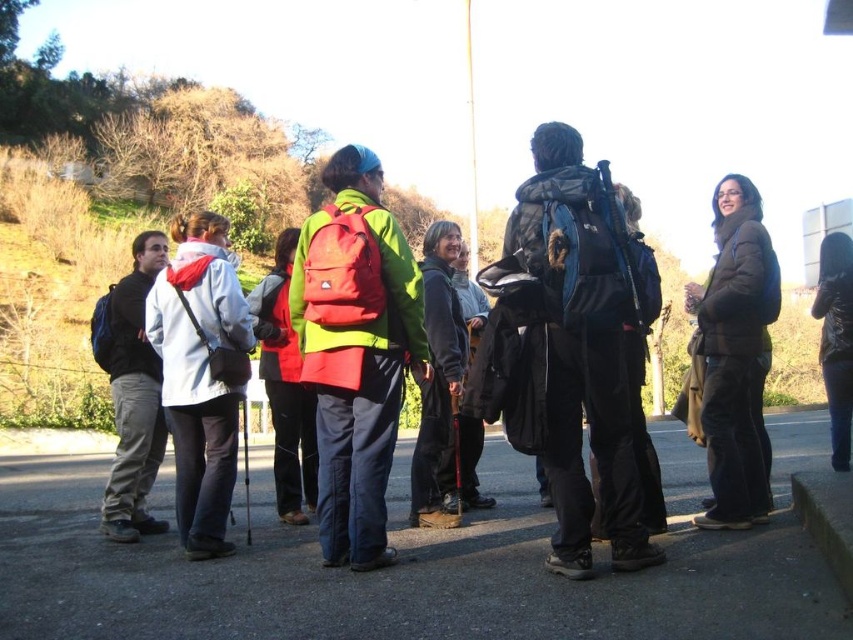
Question: Is dark blue backpack at center to the left of red matte backpack at center from the viewer's perspective?

Choices:
 (A) no
 (B) yes

Answer: (A)

Question: Can you confirm if dark blue backpack at center is positioned to the right of brown matte jacket at center?

Choices:
 (A) no
 (B) yes

Answer: (A)

Question: Which is farther from the brown matte jacket at center?

Choices:
 (A) matte black backpack at left
 (B) red matte backpack at center

Answer: (A)

Question: Does dark blue backpack at center appear on the left side of black textured jacket at right?

Choices:
 (A) no
 (B) yes

Answer: (B)

Question: Which object is closer to the camera taking this photo?

Choices:
 (A) black textured jacket at right
 (B) matte green safety vest at center
 (C) matte black backpack at center

Answer: (B)

Question: Among these objects, which one is farthest from the camera?

Choices:
 (A) white matte jacket at left
 (B) matte green safety vest at center
 (C) dark blue backpack at center

Answer: (A)